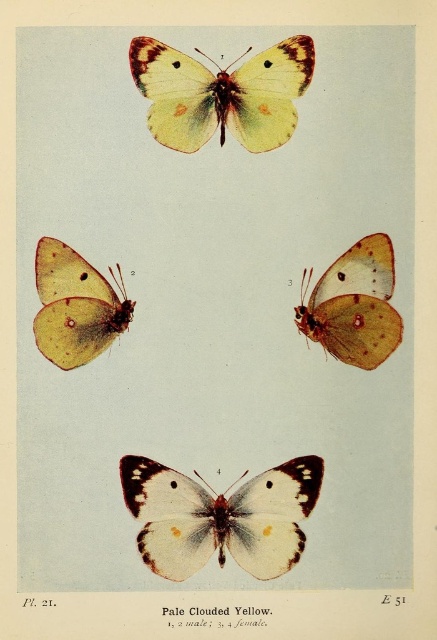
Question: Which point is farther to the camera?

Choices:
 (A) matte orange butterfly at center right
 (B) matte yellow butterfly at upper left
 (C) pale clouded yellow at center
 (D) matte yellow butterfly at upper center

Answer: (A)

Question: Does matte orange butterfly at center right appear over matte yellow butterfly at upper left?

Choices:
 (A) yes
 (B) no

Answer: (B)

Question: Can you confirm if matte yellow butterfly at upper center is positioned to the right of matte yellow butterfly at upper left?

Choices:
 (A) yes
 (B) no

Answer: (A)

Question: Is pale clouded yellow at center to the left of matte yellow butterfly at upper left from the viewer's perspective?

Choices:
 (A) no
 (B) yes

Answer: (A)

Question: Which point is farther to the camera?

Choices:
 (A) matte yellow butterfly at upper center
 (B) pale clouded yellow at center
 (C) matte yellow butterfly at upper left
 (D) matte orange butterfly at center right

Answer: (D)

Question: Based on their relative distances, which object is nearer to the matte yellow butterfly at upper center?

Choices:
 (A) matte orange butterfly at center right
 (B) pale clouded yellow at center

Answer: (A)